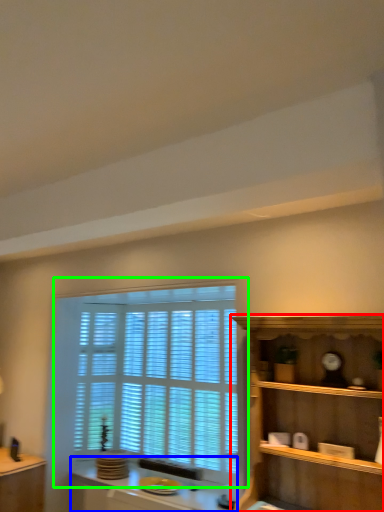
Question: Which is farther away from shelf (highlighted by a red box)? vanity (highlighted by a blue box) or window (highlighted by a green box)?

Choices:
 (A) vanity
 (B) window

Answer: (A)